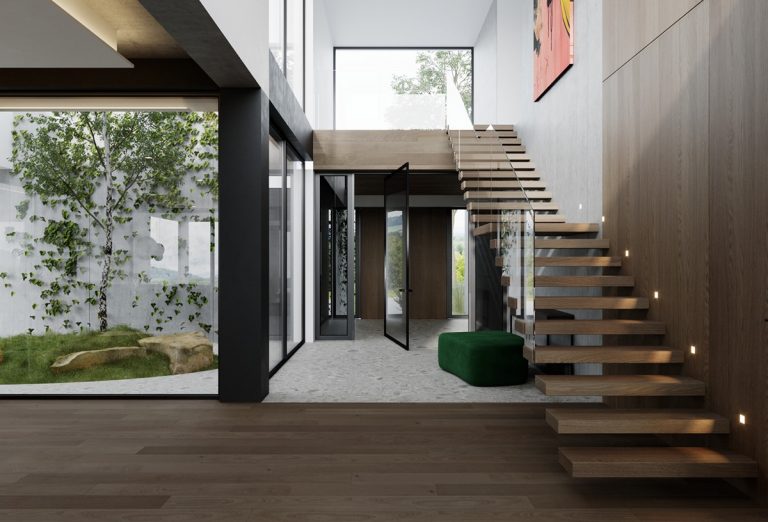
Identify the location of artwork. Image resolution: width=768 pixels, height=522 pixels. (551, 63).